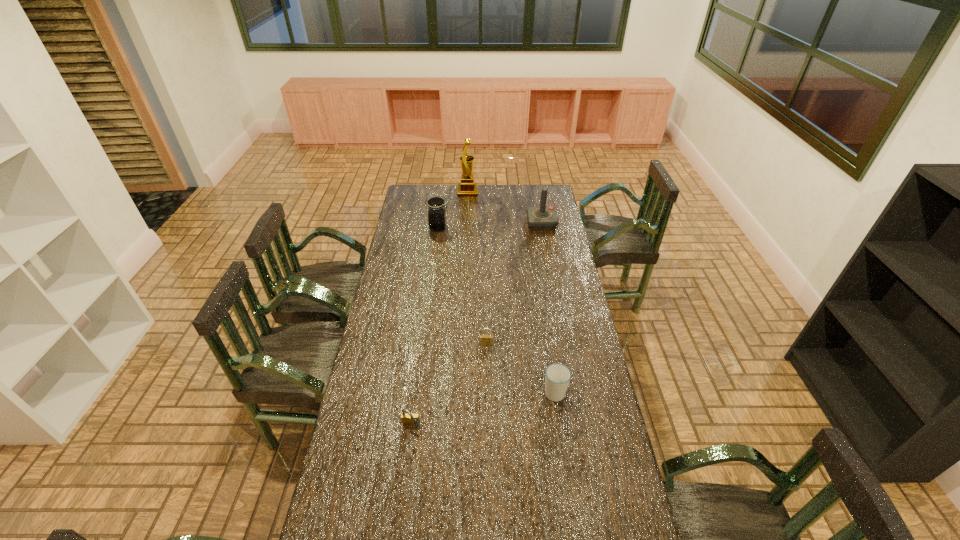
Identify which object is the fourth closest to the tallest object. Please provide its 2D coordinates. Your answer should be formatted as a tuple, i.e. [(x, y)], where the tuple contains the x and y coordinates of a point satisfying the conditions above.

[(557, 376)]

Select which object is the closest to the fifth shortest object. Please provide its 2D coordinates. Your answer should be formatted as a tuple, i.e. [(x, y)], where the tuple contains the x and y coordinates of a point satisfying the conditions above.

[(467, 188)]